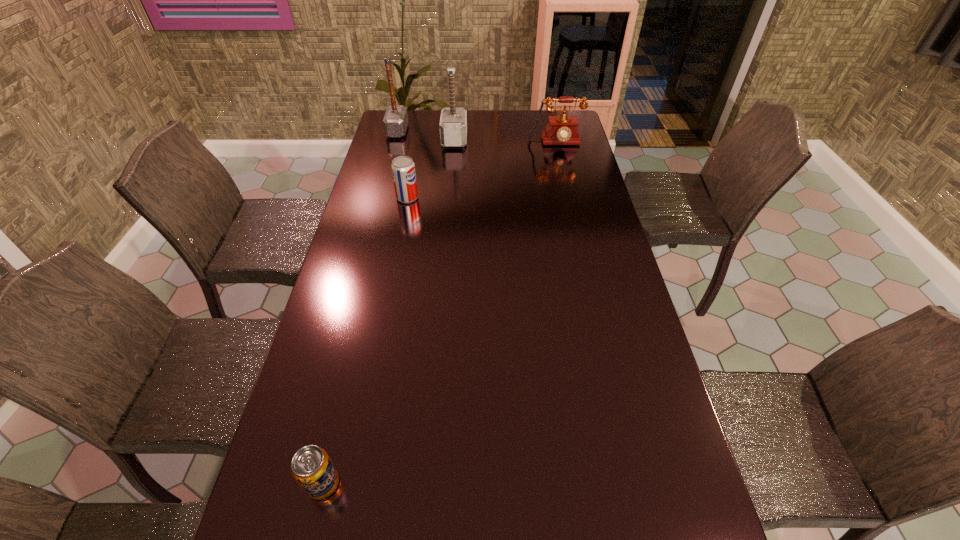
Identify the location of vacant position located on the dial of the telephone. This screenshot has width=960, height=540. (564, 185).

Locate an element on the screen. free spot located on the back of the farther soda can is located at coordinates (411, 178).

Locate an element on the screen. The width and height of the screenshot is (960, 540). vacant space located on the right of the shorter soda can is located at coordinates (455, 483).

Identify the location of hammer present at the left edge. This screenshot has height=540, width=960. (395, 121).

Where is `object located at the right edge`? The width and height of the screenshot is (960, 540). object located at the right edge is located at coordinates (561, 130).

This screenshot has height=540, width=960. What are the coordinates of `object present at the far left corner` in the screenshot? It's located at (395, 121).

The height and width of the screenshot is (540, 960). I want to click on free space at the far edge of the desktop, so click(538, 130).

Where is `free region at the left edge of the desktop`? free region at the left edge of the desktop is located at coordinates coord(374,261).

The height and width of the screenshot is (540, 960). Identify the location of blank area at the right edge. (572, 151).

Where is `vacant space at the far left corner of the desktop`? The image size is (960, 540). vacant space at the far left corner of the desktop is located at coordinates (418, 120).